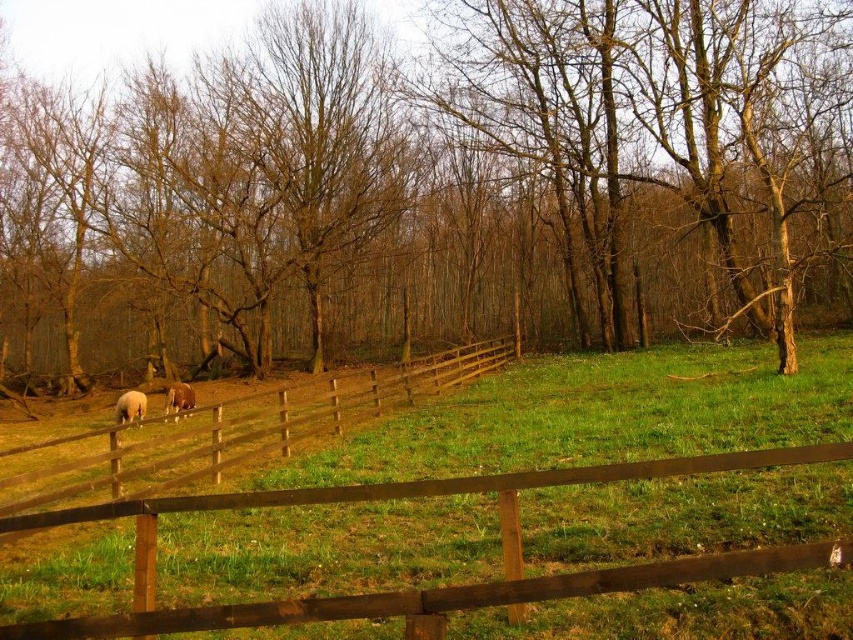
You are standing in the pasture and want to exit through the brown wooden fence at left. Based on its location, which direction should you head to reach it?

The brown wooden fence at left is located at point coordinates, so you should head towards the left side of the pasture to reach it.

You are a farmer checking the pasture. You notice the brown wooden fence at left and the white woolly sheep at center. Which object takes up more space in the image?

The brown wooden fence at left is bigger than the white woolly sheep at center, so it takes up more space in the image.